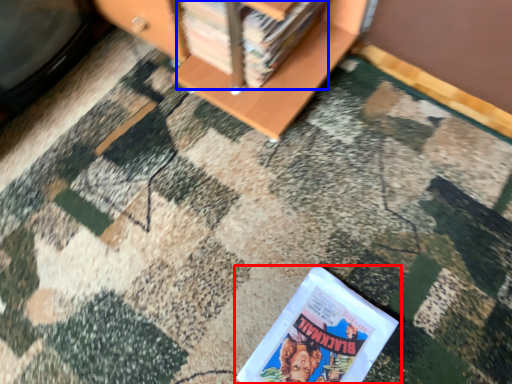
Question: Which object appears farthest to the camera in this image, book (highlighted by a red box) or book (highlighted by a blue box)?

Choices:
 (A) book
 (B) book

Answer: (B)